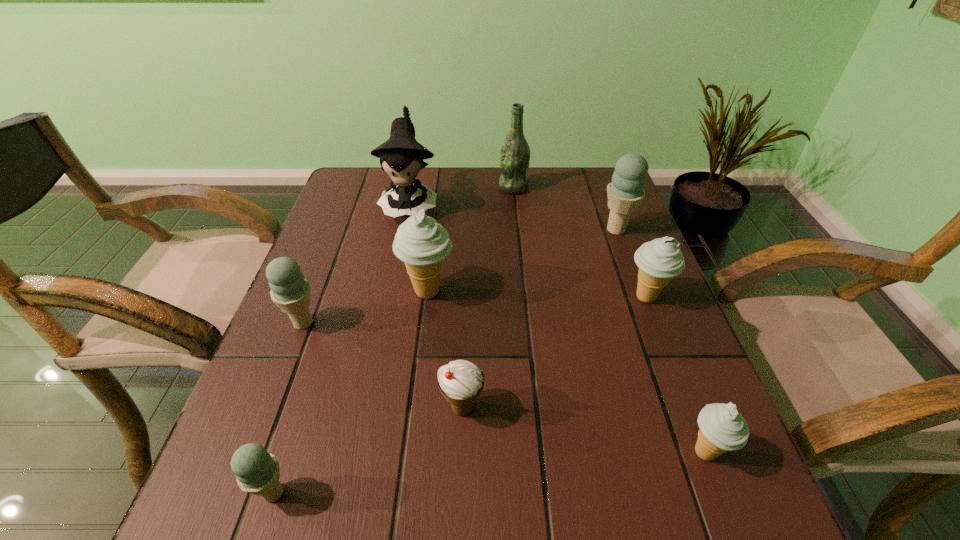
Locate an element on the screen. This screenshot has height=540, width=960. free spot between the second smallest beige icecream and the nearest beige icecream is located at coordinates (676, 375).

In order to click on free space between the second biggest beige icecream and the nearest beige icecream in this screenshot , I will do `click(676, 375)`.

This screenshot has width=960, height=540. Find the location of `free spot between the rightmost blue ice cream and the beer bottle`. free spot between the rightmost blue ice cream and the beer bottle is located at coordinates (564, 208).

Find the location of a particular element. free space between the rightmost blue ice cream and the nearest beige icecream is located at coordinates (660, 341).

Where is `free space between the green beer bottle and the nearest blue ice cream`? Image resolution: width=960 pixels, height=540 pixels. free space between the green beer bottle and the nearest blue ice cream is located at coordinates (394, 340).

At what (x,y) coordinates should I click in order to perform the action: click on vacant space that's between the third nearest object and the nearest ice cream. Please return your answer as a coordinate pair (x, y). Looking at the image, I should click on (368, 450).

Find the location of a particular element. vacant region between the fifth farthest ice cream and the second biggest blue ice cream is located at coordinates (383, 365).

At what (x,y) coordinates should I click in order to perform the action: click on object that is the sixth closest to the leftmost beige icecream. Please return your answer as a coordinate pair (x, y). The height and width of the screenshot is (540, 960). Looking at the image, I should click on (x=658, y=260).

Point out which object is positioned as the nearest to the white icecream. Please provide its 2D coordinates. Your answer should be formatted as a tuple, i.e. [(x, y)], where the tuple contains the x and y coordinates of a point satisfying the conditions above.

[(421, 243)]

Find the location of a particular element. This screenshot has width=960, height=540. ice cream object that ranks as the seventh closest to the doll is located at coordinates (722, 428).